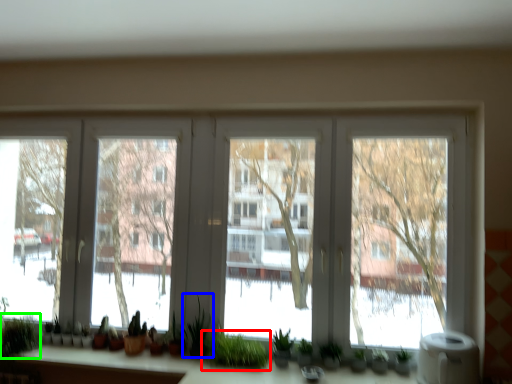
Question: Considering the real-world distances, which object is closest to houseplant (highlighted by a red box)? plant (highlighted by a blue box) or plant (highlighted by a green box).

Choices:
 (A) plant
 (B) plant

Answer: (A)